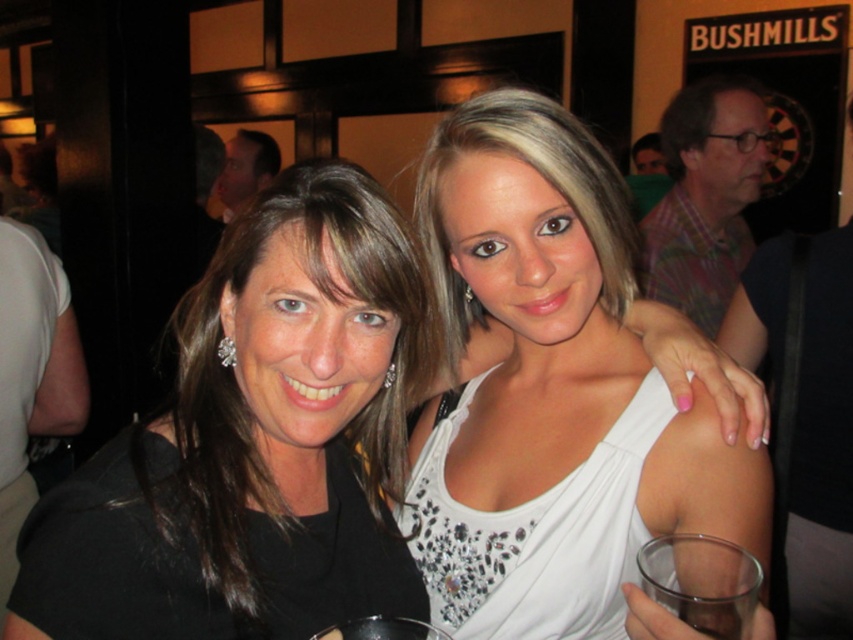
You are a photographer at the event and want to capture a closeup of the transparent plastic wine glass at lower center without the white satin dress at center appearing in the frame. Is this possible given their sizes?

The white satin dress at center is larger in size than the transparent plastic wine glass at lower center. Since the dress is larger, it might block the view of the glass depending on their positions. However, without knowing their exact spatial arrangement, it is uncertain if the glass can be framed without the dress visible.

You are at a social event and want to place a small decorative item on the table between the plaid shirt at upper right and the transparent plastic wine glass at lower center. Based on their positions, which object is closer to the edge of the table?

The transparent plastic wine glass at lower center is closer to the edge of the table because it is positioned lower than the plaid shirt at upper right, which is further from the edge.